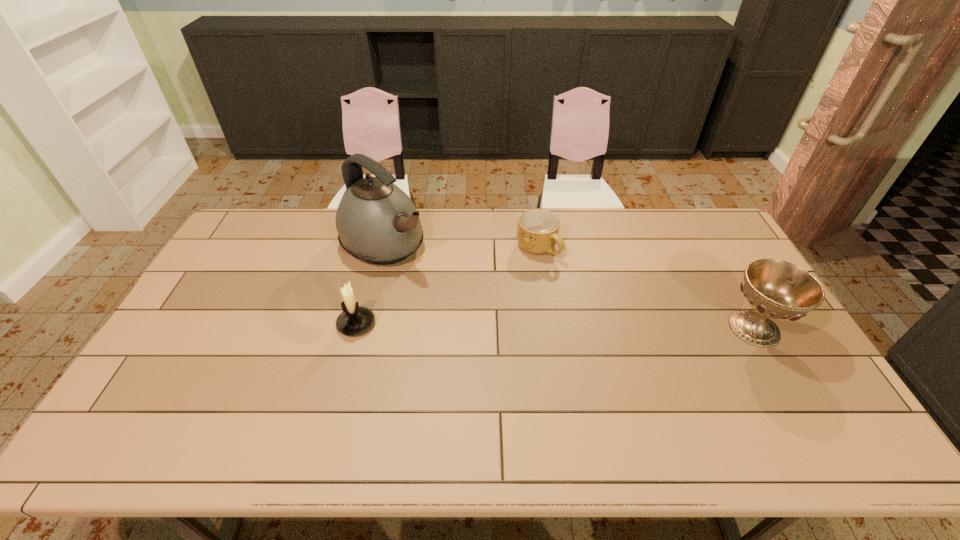
Image resolution: width=960 pixels, height=540 pixels. What are the coordinates of `vacant area at the far left corner` in the screenshot? It's located at (289, 213).

Where is `vacant space in between the candle holder and the tallest object`? The width and height of the screenshot is (960, 540). vacant space in between the candle holder and the tallest object is located at coordinates (371, 284).

Where is `free space between the candle holder and the kettle`? free space between the candle holder and the kettle is located at coordinates (371, 284).

Image resolution: width=960 pixels, height=540 pixels. I want to click on free space that is in between the third object from left to right and the kettle, so click(x=462, y=246).

The image size is (960, 540). I want to click on free space between the second object from right to left and the candle holder, so click(x=447, y=286).

You are a GUI agent. You are given a task and a screenshot of the screen. Output one action in this format:
    pyautogui.click(x=<x>, y=<y>)
    Task: Click on the free space between the mug and the tallest object
    
    Given the screenshot: What is the action you would take?
    pyautogui.click(x=462, y=246)

Where is `free space between the second object from right to left and the chalice`? The image size is (960, 540). free space between the second object from right to left and the chalice is located at coordinates (646, 288).

The image size is (960, 540). I want to click on free space between the shortest object and the candle holder, so click(x=447, y=286).

Find the location of a particular element. empty space that is in between the candle holder and the second object from right to left is located at coordinates (447, 286).

You are a GUI agent. You are given a task and a screenshot of the screen. Output one action in this format:
    pyautogui.click(x=<x>, y=<y>)
    Task: Click on the free space between the candle holder and the kettle
    This screenshot has width=960, height=540.
    Given the screenshot: What is the action you would take?
    pyautogui.click(x=371, y=284)